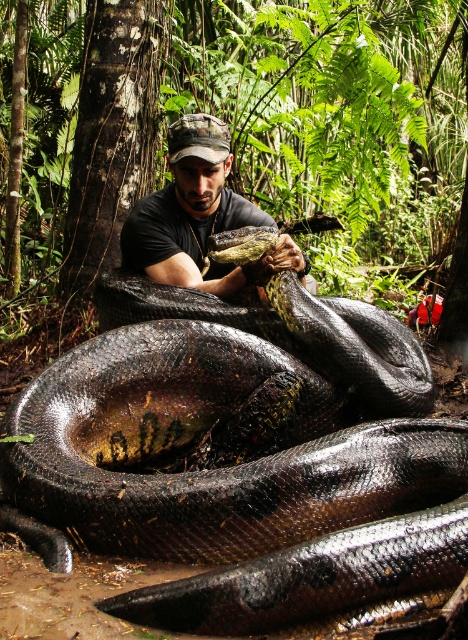
You are a wildlife photographer aiming to capture the shiny black snake at center in your photo. Based on its position, where should you focus your camera to ensure the snake is centered in the frame?

The shiny black snake at center is located at point 2D coordinates of (242, 467), so you should focus your camera at that point to center the snake in the frame.

You are a wildlife photographer aiming to capture a closeup of the shiny black snake at center and the matte black shirt at center. Since you want to focus on the snake, which object should you adjust your camera settings to prioritize in terms of size?

The shiny black snake at center is larger in width than the matte black shirt at center, so you should prioritize focusing on the shiny black snake at center to ensure it fills the frame appropriately.

You are a wildlife photographer aiming to capture a closeup shot of the shiny black snake at center. However, the matte black shirt at center is blocking your view. Can you determine if the snake is positioned above or below the shirt?

The shiny black snake at center is located below the matte black shirt at center, so it is positioned below the shirt.